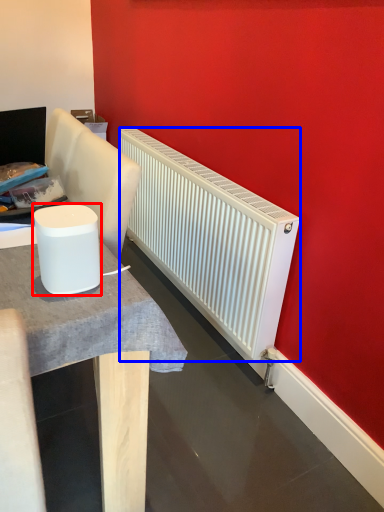
Question: Which object is further to the camera taking this photo, appliance (highlighted by a red box) or radiator (highlighted by a blue box)?

Choices:
 (A) appliance
 (B) radiator

Answer: (B)